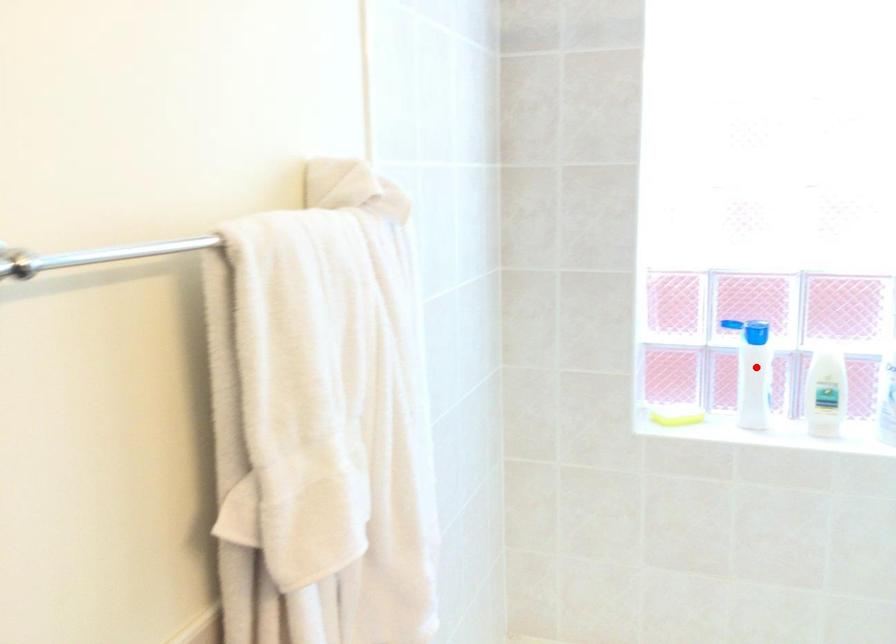
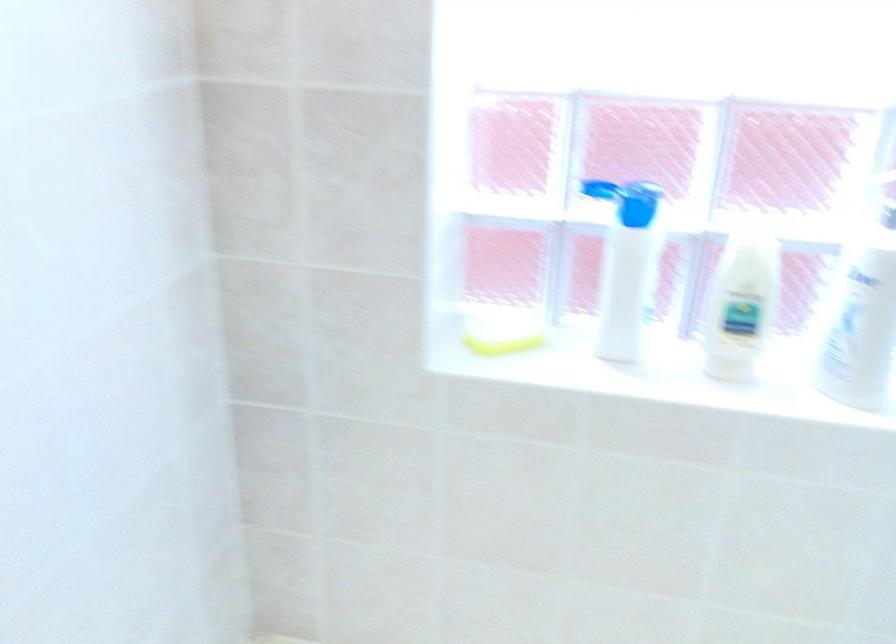
Question: A red point is marked in image1. In image2, is the corresponding 3D point closer to the camera or farther? Reply with the corresponding letter.

Choices:
 (A) The corresponding 3D point is closer.
 (B) The corresponding 3D point is farther.

Answer: (A)